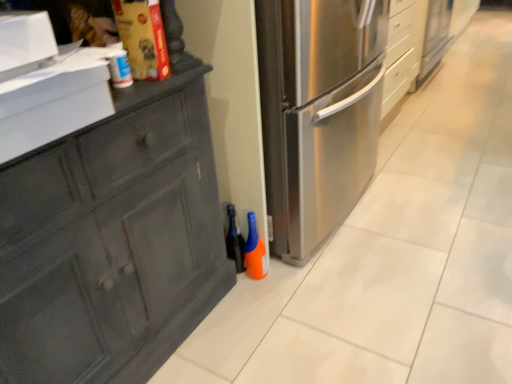
Where is `vacant area that lies in front of orange matte bottle at lower center, which is the first bottle in right-to-left order`? This screenshot has width=512, height=384. vacant area that lies in front of orange matte bottle at lower center, which is the first bottle in right-to-left order is located at coordinates (258, 298).